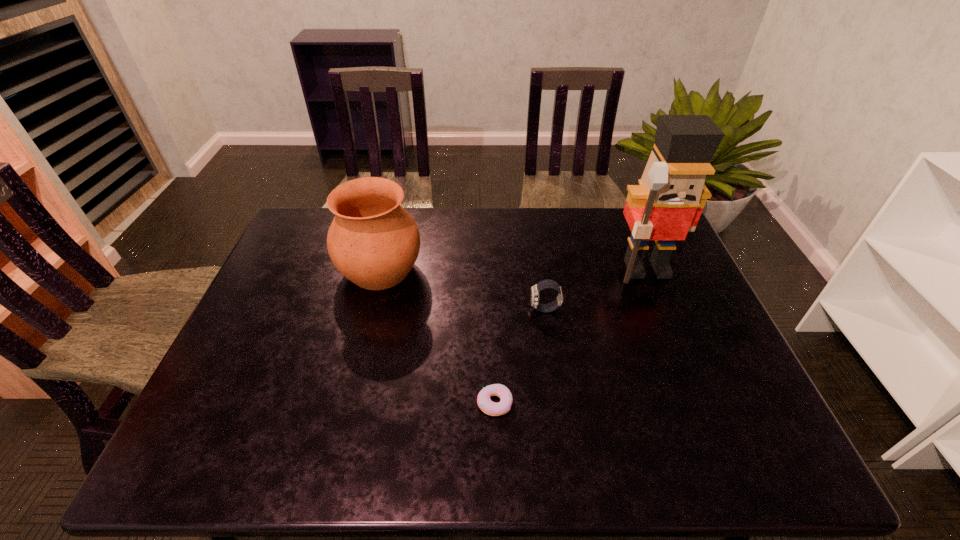
The height and width of the screenshot is (540, 960). In the image, there is a desktop. Find the location of `free space at the left edge`. free space at the left edge is located at coordinates (328, 258).

In the image, there is a desktop. Where is `vacant space at the near left corner`? This screenshot has width=960, height=540. vacant space at the near left corner is located at coordinates (220, 466).

Locate an element on the screen. vacant space at the near right corner of the desktop is located at coordinates (734, 438).

At what (x,y) coordinates should I click in order to perform the action: click on free spot between the doughnut and the tallest object. Please return your answer as a coordinate pair (x, y). The width and height of the screenshot is (960, 540). Looking at the image, I should click on (571, 336).

The image size is (960, 540). Identify the location of free space that is in between the rightmost object and the third tallest object. (596, 289).

At what (x,y) coordinates should I click in order to perform the action: click on free space between the tallest object and the third object from left to right. Please return your answer as a coordinate pair (x, y). The height and width of the screenshot is (540, 960). Looking at the image, I should click on (596, 289).

At what (x,y) coordinates should I click in order to perform the action: click on free point between the shortest object and the pottery. Please return your answer as a coordinate pair (x, y). This screenshot has width=960, height=540. Looking at the image, I should click on (438, 336).

Where is `free space between the doughnut and the pottery`? free space between the doughnut and the pottery is located at coordinates (438, 336).

The height and width of the screenshot is (540, 960). In order to click on unoccupied area between the leftmost object and the third object from right to left in this screenshot , I will do `click(438, 336)`.

You are a GUI agent. You are given a task and a screenshot of the screen. Output one action in this format:
    pyautogui.click(x=<x>, y=<y>)
    Task: Click on the vacant space that is in between the pottery and the tallest object
    The height and width of the screenshot is (540, 960).
    Given the screenshot: What is the action you would take?
    pyautogui.click(x=514, y=269)